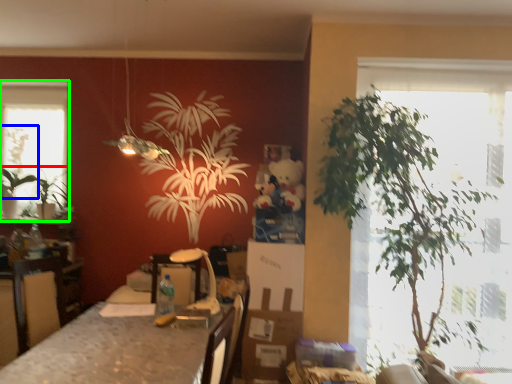
Question: Which object is positioned farthest from houseplant (highlighted by a red box)? Select from plant (highlighted by a blue box) and window (highlighted by a green box).

Choices:
 (A) plant
 (B) window

Answer: (B)